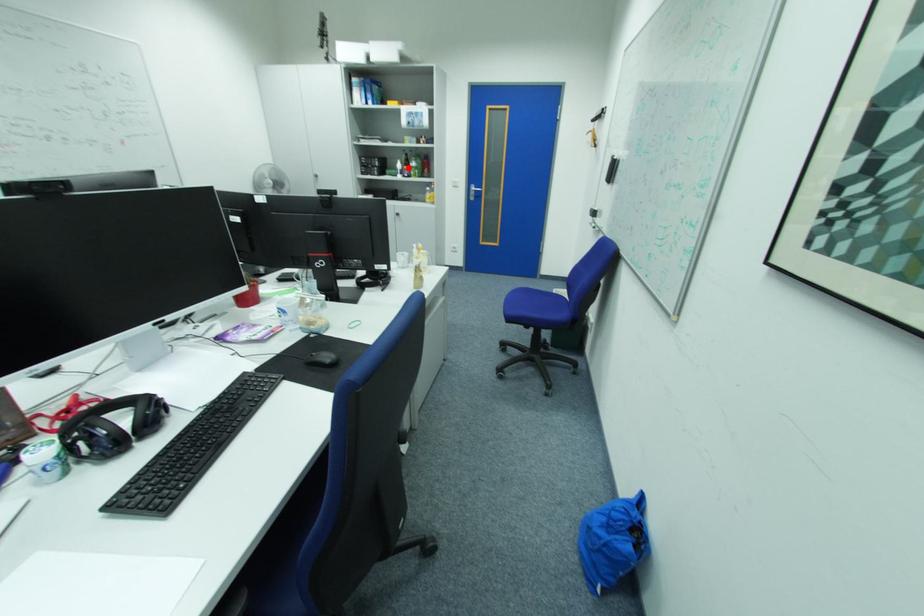
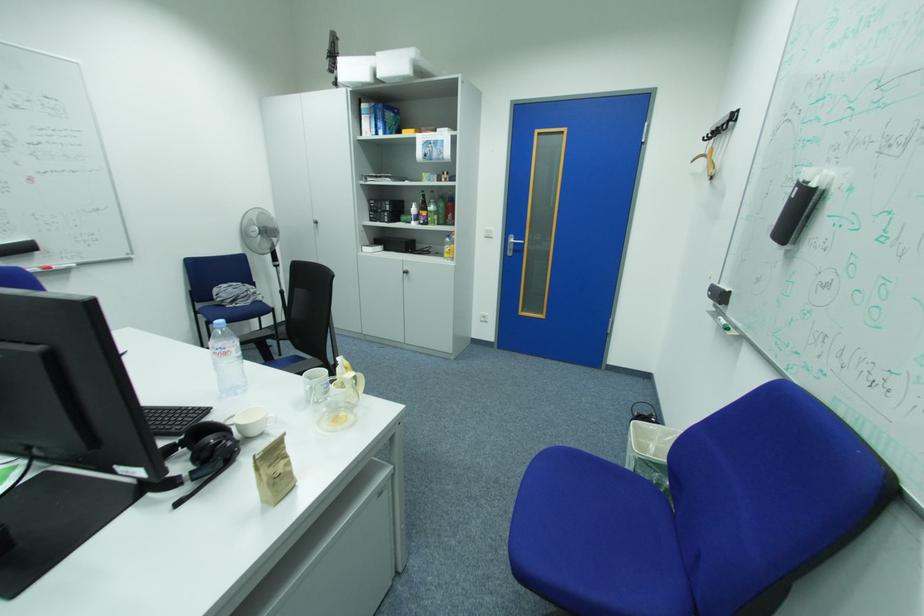
Locate, in the second image, the point that corresponds to the highlighted location in the first image.

(422, 211)